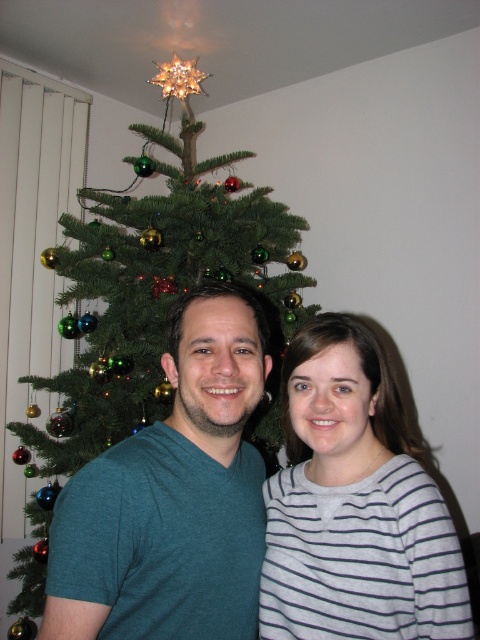
You are a photographer taking a picture of the gray striped shirt at center and the green matte christmas tree at center. Which object is shorter in the photo?

The gray striped shirt at center is not as tall as the green matte christmas tree at center, so the gray striped shirt at center is shorter.

You are a photographer standing at the camera position. You want to take a closeup shot of the gray striped shirt at center. Can you estimate how far you need to move forward to get the subject into focus if your camera requires the subject to be 12 inches away?

The gray striped shirt at center is currently 32.48 inches away from the camera. To get it to 12 inches away, you need to move forward by 20.48 inches.